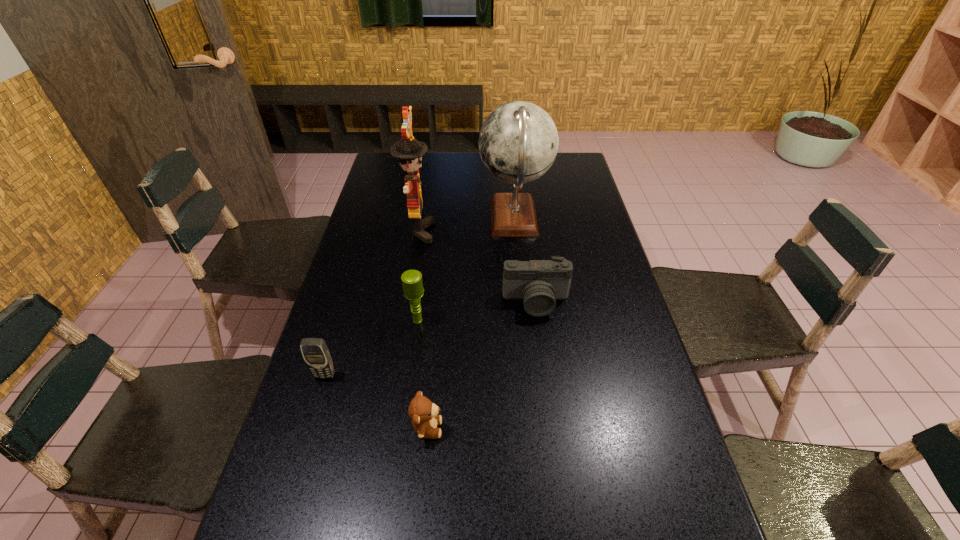
Identify the location of unoccupied area between the globe and the nutcracker. (467, 225).

Find the location of a particular element. The width and height of the screenshot is (960, 540). vacant space that is in between the nearest object and the globe is located at coordinates (470, 323).

Locate an element on the screen. vacant space that's between the camera and the globe is located at coordinates (525, 260).

Locate an element on the screen. This screenshot has width=960, height=540. free space between the camera and the nearest object is located at coordinates (482, 365).

At what (x,y) coordinates should I click in order to perform the action: click on vacant region between the camera and the second nearest object. Please return your answer as a coordinate pair (x, y). Looking at the image, I should click on (430, 339).

I want to click on vacant point located between the camera and the globe, so click(x=525, y=260).

The width and height of the screenshot is (960, 540). In order to click on object identified as the fourth closest to the nutcracker in this screenshot , I will do `click(316, 354)`.

Point out which object is positioned as the second nearest to the teddy bear. Please provide its 2D coordinates. Your answer should be formatted as a tuple, i.e. [(x, y)], where the tuple contains the x and y coordinates of a point satisfying the conditions above.

[(412, 283)]

Identify the location of free region that satisfies the following two spatial constraints: 1. on the front-facing side of the nutcracker; 2. on the front face of the cellular telephone. (395, 375).

Where is `free space that satisfies the following two spatial constraints: 1. on the front-facing side of the third tallest object; 2. on the left side of the nutcracker`? free space that satisfies the following two spatial constraints: 1. on the front-facing side of the third tallest object; 2. on the left side of the nutcracker is located at coordinates (403, 321).